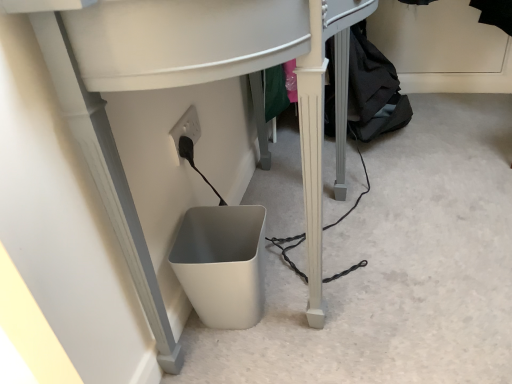
I want to click on free space in front of white matte waste container at lower center, so click(x=242, y=359).